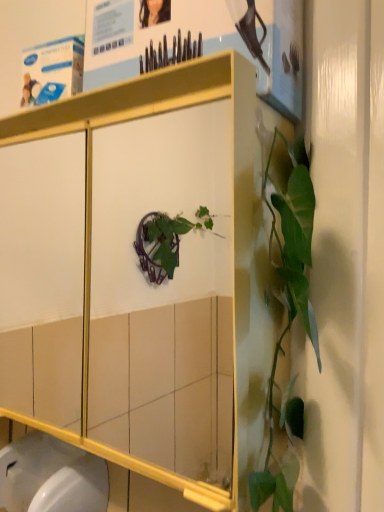
Question: Considering the relative sizes of white glossy toilet bowl at lower left and metallic white cabinet at center in the image provided, is white glossy toilet bowl at lower left shorter than metallic white cabinet at center?

Choices:
 (A) no
 (B) yes

Answer: (B)

Question: Is white glossy toilet bowl at lower left outside of metallic white cabinet at center?

Choices:
 (A) yes
 (B) no

Answer: (A)

Question: Is white glossy toilet bowl at lower left placed right next to metallic white cabinet at center?

Choices:
 (A) no
 (B) yes

Answer: (A)

Question: Considering the relative sizes of white glossy toilet bowl at lower left and metallic white cabinet at center in the image provided, is white glossy toilet bowl at lower left thinner than metallic white cabinet at center?

Choices:
 (A) no
 (B) yes

Answer: (B)

Question: Can you confirm if white glossy toilet bowl at lower left is positioned to the right of metallic white cabinet at center?

Choices:
 (A) no
 (B) yes

Answer: (A)

Question: From the image's perspective, is metallic white cabinet at center positioned above or below white glossy toilet bowl at lower left?

Choices:
 (A) above
 (B) below

Answer: (A)

Question: Is point (89, 201) closer or farther from the camera than point (82, 503)?

Choices:
 (A) farther
 (B) closer

Answer: (A)

Question: From a real-world perspective, is metallic white cabinet at center above or below white glossy toilet bowl at lower left?

Choices:
 (A) below
 (B) above

Answer: (B)

Question: Considering the positions of metallic white cabinet at center and white glossy toilet bowl at lower left in the image, is metallic white cabinet at center taller or shorter than white glossy toilet bowl at lower left?

Choices:
 (A) short
 (B) tall

Answer: (B)

Question: Is matte paper poster at upper center in front of or behind metallic white cabinet at center in the image?

Choices:
 (A) front
 (B) behind

Answer: (B)

Question: Is point (236, 35) positioned closer to the camera than point (67, 123)?

Choices:
 (A) closer
 (B) farther

Answer: (A)

Question: Looking at their shapes, would you say matte paper poster at upper center is wider or thinner than metallic white cabinet at center?

Choices:
 (A) thin
 (B) wide

Answer: (A)

Question: Is matte paper poster at upper center to the left or to the right of metallic white cabinet at center in the image?

Choices:
 (A) right
 (B) left

Answer: (A)

Question: Do you think matte paper poster at upper center is within white glossy toilet bowl at lower left, or outside of it?

Choices:
 (A) inside
 (B) outside

Answer: (B)

Question: Considering their positions, is matte paper poster at upper center located in front of or behind white glossy toilet bowl at lower left?

Choices:
 (A) behind
 (B) front

Answer: (B)